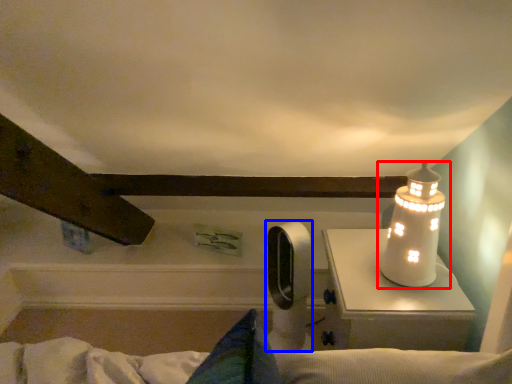
Question: Among these objects, which one is nearest to the camera, lamp (highlighted by a red box) or equipment (highlighted by a blue box)?

Choices:
 (A) lamp
 (B) equipment

Answer: (A)